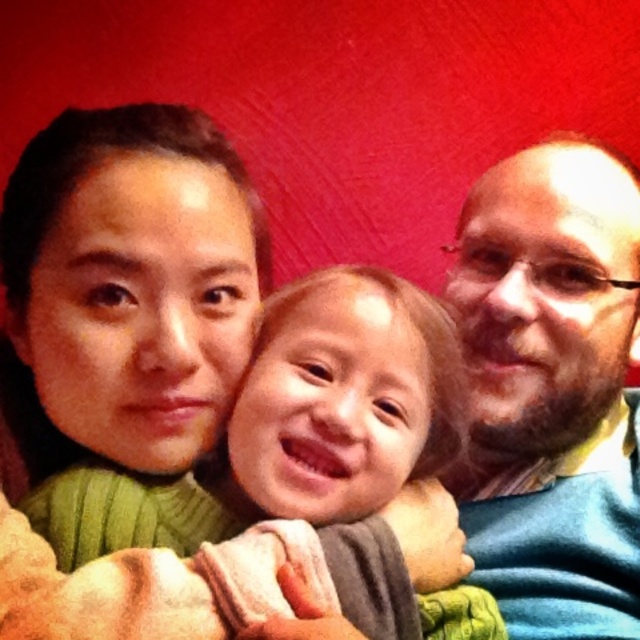
Is point (600, 237) behind point (374, 596)?

Yes, point (600, 237) is farther from viewer.

The height and width of the screenshot is (640, 640). I want to click on blue sweater at right, so click(x=552, y=387).

Find the location of a particular element. This screenshot has height=640, width=640. blue sweater at right is located at coordinates (552, 387).